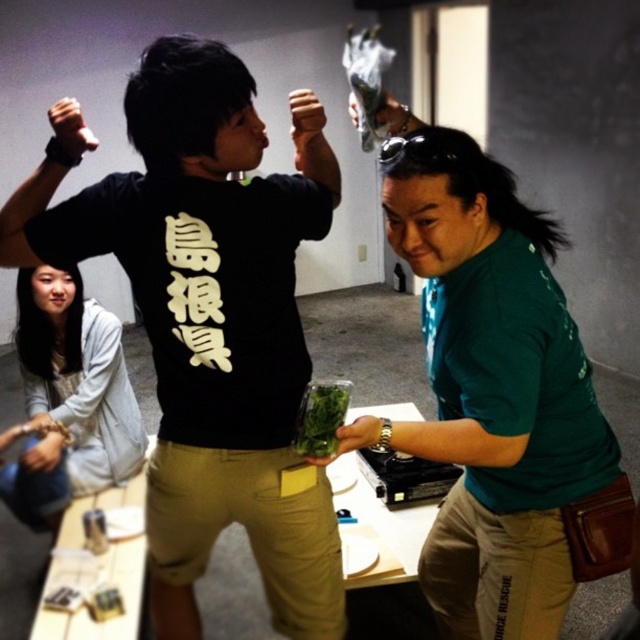
Who is taller, light gray hoodie at lower left or green leafy vegetable at center?

light gray hoodie at lower left is taller.

Does point (104, 385) lie in front of point (307, 454)?

No, it is behind (307, 454).

Which is behind, point (76, 301) or point (305, 449)?

Positioned behind is point (76, 301).

Locate an element on the screen. This screenshot has height=640, width=640. light gray hoodie at lower left is located at coordinates (68, 397).

Which is below, light gray hoodie at lower left or matte black fist at center?

Positioned lower is light gray hoodie at lower left.

Can you confirm if light gray hoodie at lower left is positioned below matte black fist at center?

Indeed, light gray hoodie at lower left is positioned under matte black fist at center.

Does point (90, 360) come farther from viewer compared to point (307, 108)?

Yes.

Identify the location of light gray hoodie at lower left. Image resolution: width=640 pixels, height=640 pixels. (68, 397).

Looking at this image, which is more to the left, light gray hoodie at lower left or black leather wristband at upper left?

From the viewer's perspective, light gray hoodie at lower left appears more on the left side.

Does light gray hoodie at lower left appear on the left side of black leather wristband at upper left?

Yes, light gray hoodie at lower left is to the left of black leather wristband at upper left.

Is point (44, 268) less distant than point (74, 106)?

No.

Locate an element on the screen. The image size is (640, 640). light gray hoodie at lower left is located at coordinates (68, 397).